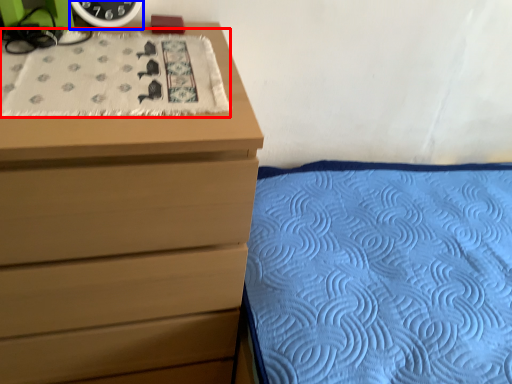
Question: Which of the following is the closest to the observer, blanket (highlighted by a red box) or clock (highlighted by a blue box)?

Choices:
 (A) blanket
 (B) clock

Answer: (A)